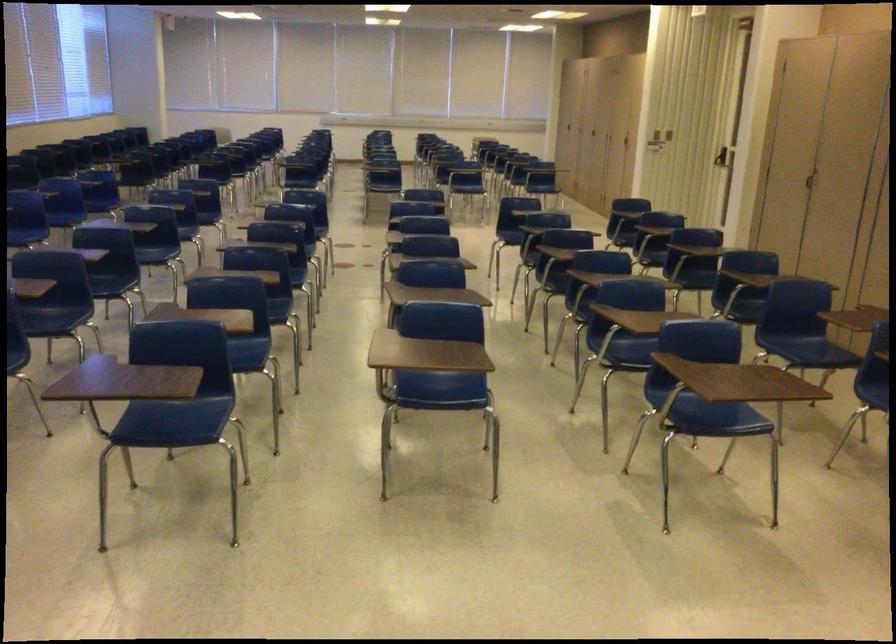
Find where to pull the door handle. Please return your answer as a coordinate pair (x, y).

(721, 158)